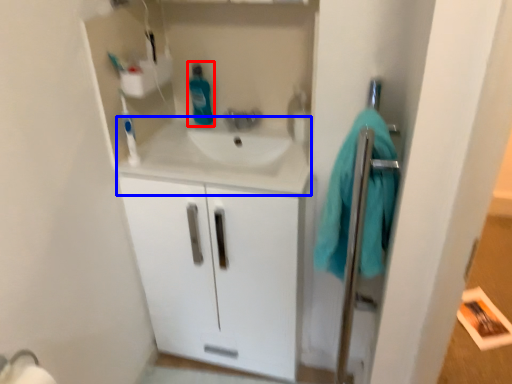
Question: Which point is further to the camera, cleaning product (highlighted by a red box) or counter top (highlighted by a blue box)?

Choices:
 (A) cleaning product
 (B) counter top

Answer: (A)